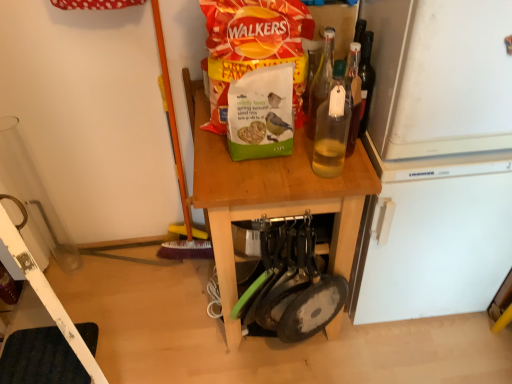
The height and width of the screenshot is (384, 512). What are the coordinates of `free space to the left of transparent glass bottle at center, which appears as the first bottle when viewed from the front` in the screenshot? It's located at (273, 180).